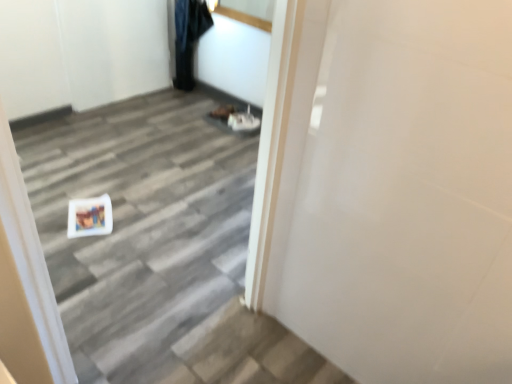
Question: Is white glossy door at center positioned beyond the bounds of denim pants at upper center?

Choices:
 (A) no
 (B) yes

Answer: (B)

Question: Is the position of white glossy door at center less distant than that of denim pants at upper center?

Choices:
 (A) yes
 (B) no

Answer: (A)

Question: Does white glossy door at center have a lesser height compared to denim pants at upper center?

Choices:
 (A) no
 (B) yes

Answer: (A)

Question: Does white glossy door at center have a lesser width compared to denim pants at upper center?

Choices:
 (A) no
 (B) yes

Answer: (B)

Question: From a real-world perspective, is white glossy door at center on denim pants at upper center?

Choices:
 (A) no
 (B) yes

Answer: (B)

Question: From the image's perspective, would you say white glossy door at center is shown under denim pants at upper center?

Choices:
 (A) no
 (B) yes

Answer: (B)

Question: Is denim pants at upper center outside white glossy door at center?

Choices:
 (A) no
 (B) yes

Answer: (B)

Question: Does denim pants at upper center have a larger size compared to white glossy door at center?

Choices:
 (A) yes
 (B) no

Answer: (B)

Question: Is denim pants at upper center at the left side of white glossy door at center?

Choices:
 (A) no
 (B) yes

Answer: (B)

Question: From a real-world perspective, is denim pants at upper center below white glossy door at center?

Choices:
 (A) no
 (B) yes

Answer: (B)

Question: Can you confirm if denim pants at upper center is smaller than white glossy door at center?

Choices:
 (A) no
 (B) yes

Answer: (B)

Question: Could you tell me if denim pants at upper center is turned towards white glossy door at center?

Choices:
 (A) yes
 (B) no

Answer: (B)

Question: From the image's perspective, relative to denim pants at upper center, is white glossy door at center above or below?

Choices:
 (A) below
 (B) above

Answer: (A)